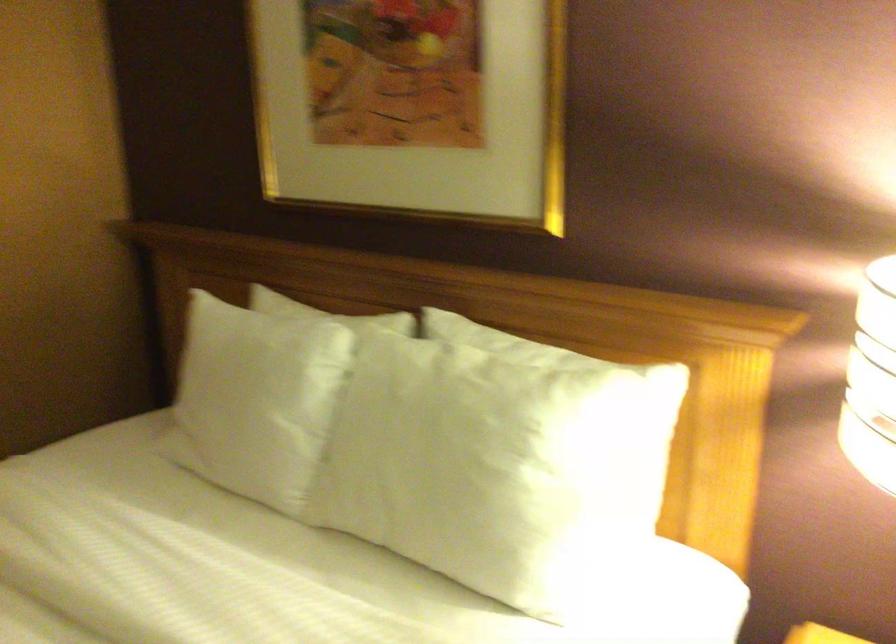
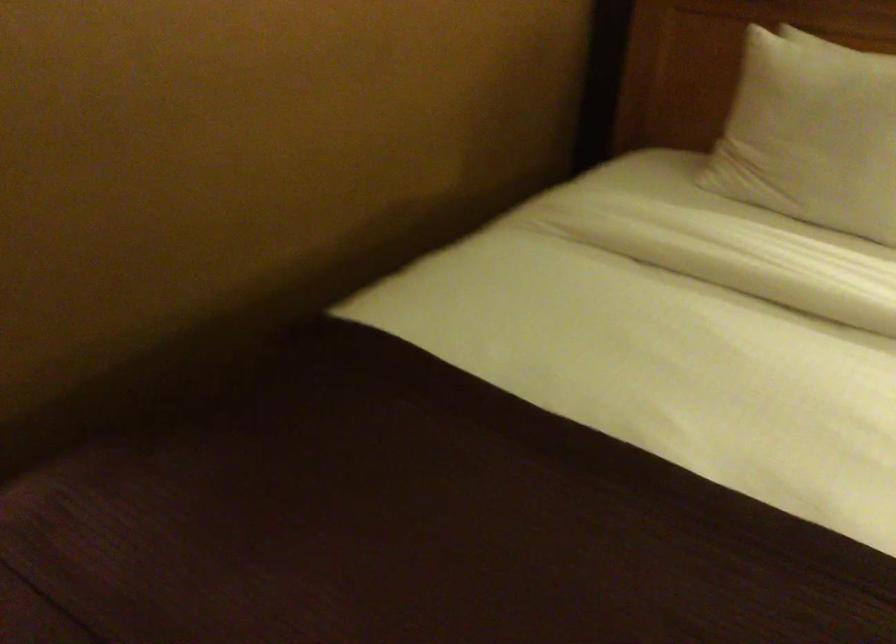
Question: The images are taken continuously from a first-person perspective. In which direction are you moving?

Choices:
 (A) Left
 (B) Right
 (C) Forward
 (D) Backward

Answer: (A)